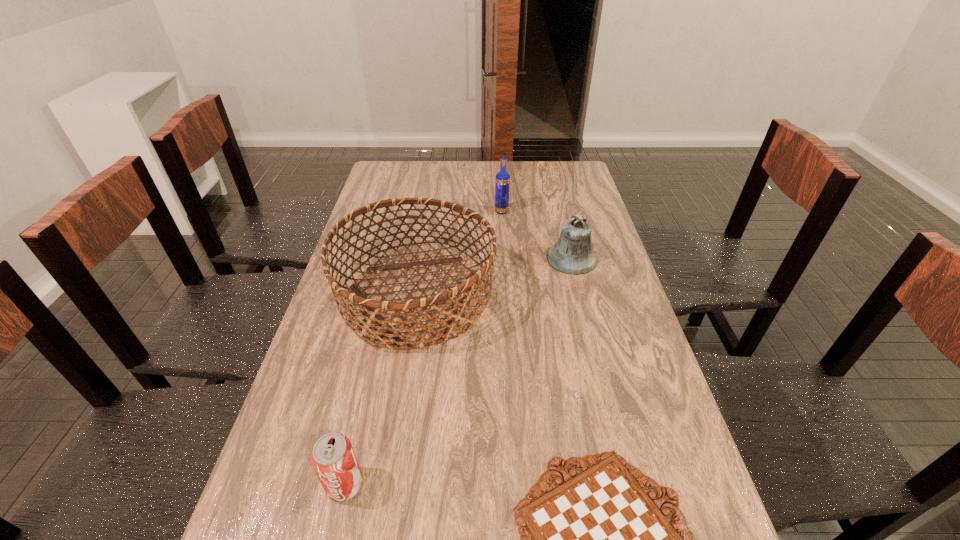
This screenshot has height=540, width=960. I want to click on vodka, so 502,181.

Identify the location of basket. This screenshot has width=960, height=540. 376,310.

I want to click on bell, so click(x=572, y=254).

Find the location of a particular element. soda can is located at coordinates (332, 457).

This screenshot has width=960, height=540. I want to click on vacant space situated on the left of the vodka, so click(x=415, y=212).

This screenshot has width=960, height=540. Identify the location of free space located on the front of the basket. (389, 470).

This screenshot has width=960, height=540. In order to click on blank space located on the back of the bell in this screenshot , I will do `click(564, 225)`.

Locate an element on the screen. The width and height of the screenshot is (960, 540). vacant space situated on the back of the soda can is located at coordinates (356, 434).

Locate an element on the screen. basket located at the left edge is located at coordinates (376, 310).

The image size is (960, 540). In order to click on soda can present at the left edge in this screenshot , I will do `click(332, 457)`.